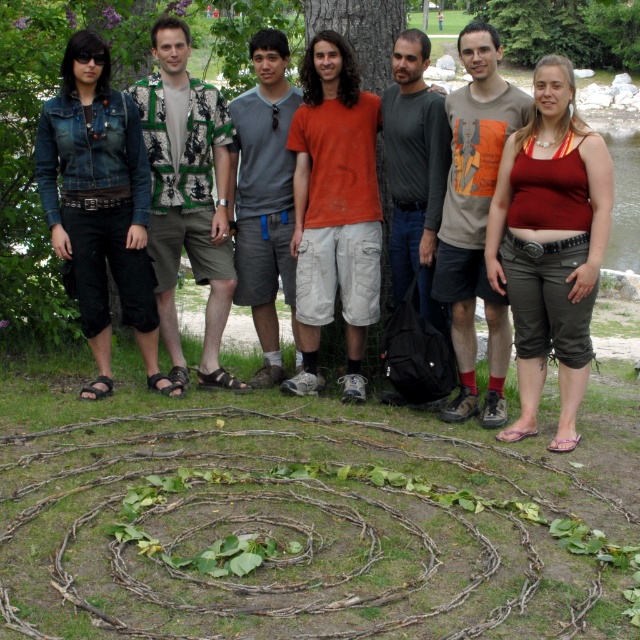
Is printed cotton shirt at center to the right of gray cotton t-shirt at center from the viewer's perspective?

Incorrect, printed cotton shirt at center is not on the right side of gray cotton t-shirt at center.

Between point (176, 355) and point (285, 260), which one is positioned behind?

Positioned behind is point (176, 355).

Find the location of a particular element. The image size is (640, 640). printed cotton shirt at center is located at coordinates (188, 195).

In the scene shown: Does matte red tank top at right appear on the right side of gray cotton t-shirt at center?

Correct, you'll find matte red tank top at right to the right of gray cotton t-shirt at center.

Can you confirm if matte red tank top at right is thinner than gray cotton t-shirt at center?

No, matte red tank top at right is not thinner than gray cotton t-shirt at center.

This screenshot has width=640, height=640. Identify the location of matte red tank top at right. (550, 244).

Based on the photo, which is below, matte red tank top at right or orange cotton t-shirt at center?

matte red tank top at right

Is point (536, 374) positioned in front of point (355, 81)?

Yes, point (536, 374) is in front of point (355, 81).

Between point (576, 140) and point (342, 81), which one is positioned in front?

Point (576, 140) is more forward.

Identify the location of matte red tank top at right. The image size is (640, 640). (550, 244).